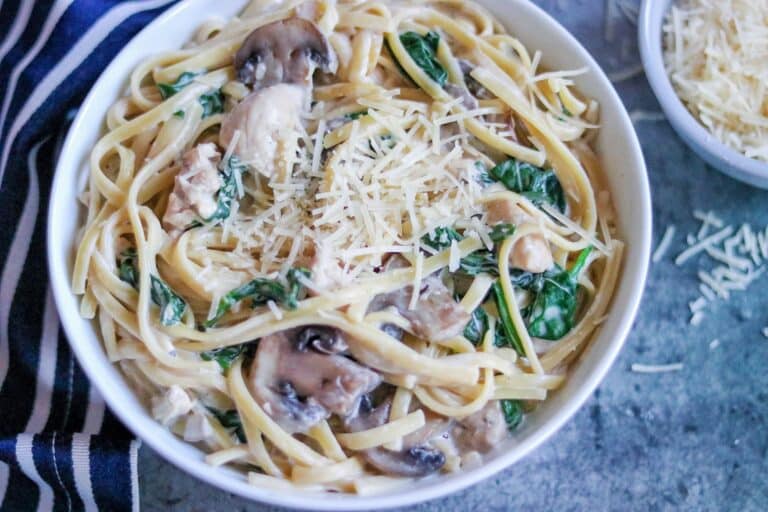
Identify the location of blue and white stripped napkin. (22, 42).